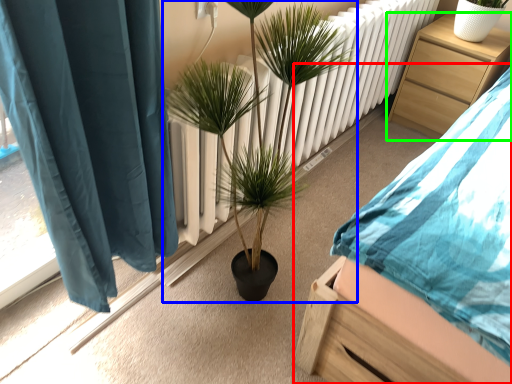
Question: Which is farther away from bed (highlighted by a red box)? houseplant (highlighted by a blue box) or nightstand (highlighted by a green box)?

Choices:
 (A) houseplant
 (B) nightstand

Answer: (B)